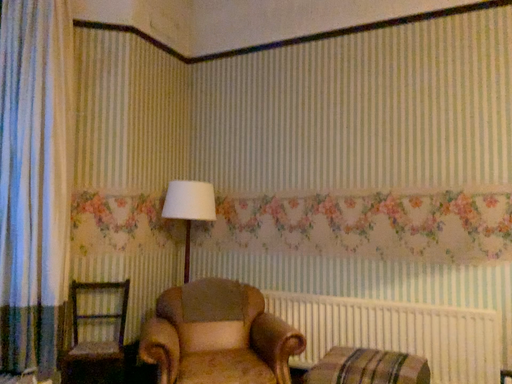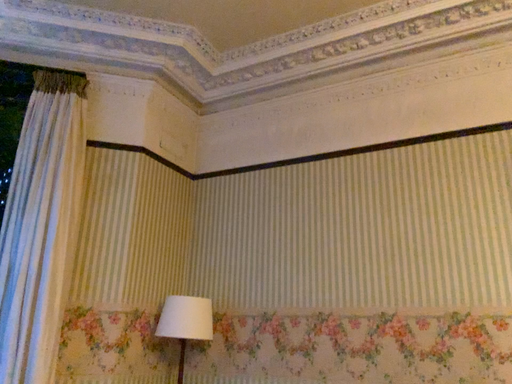
Question: Which way did the camera rotate in the video?

Choices:
 (A) rotated upward
 (B) rotated downward

Answer: (A)